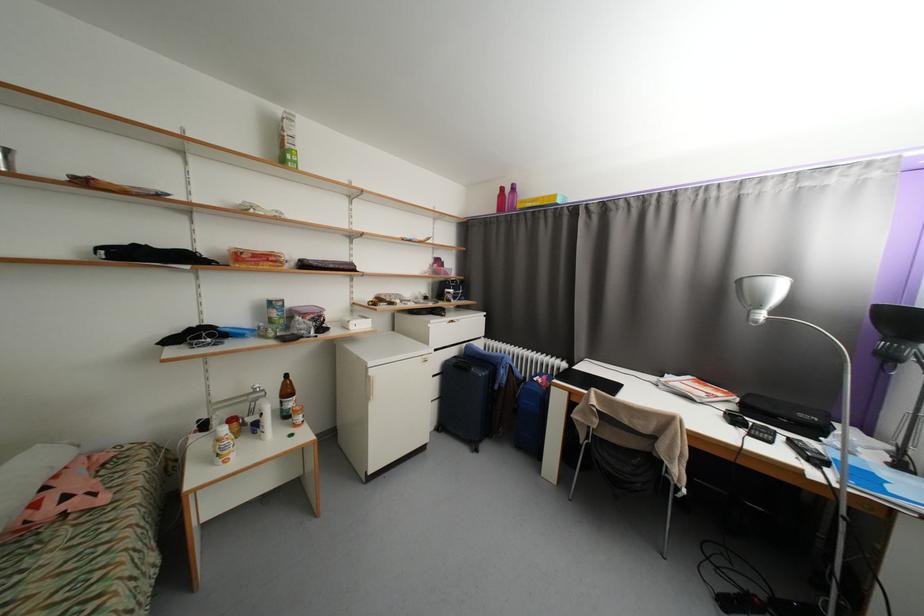
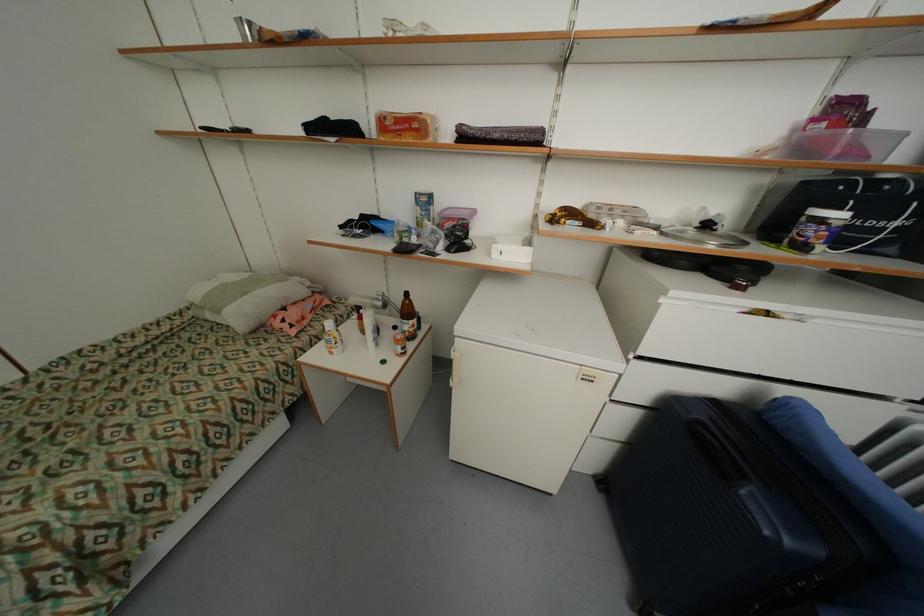
Find the pixel in the second image that matches (456,297) in the first image.

(819, 233)